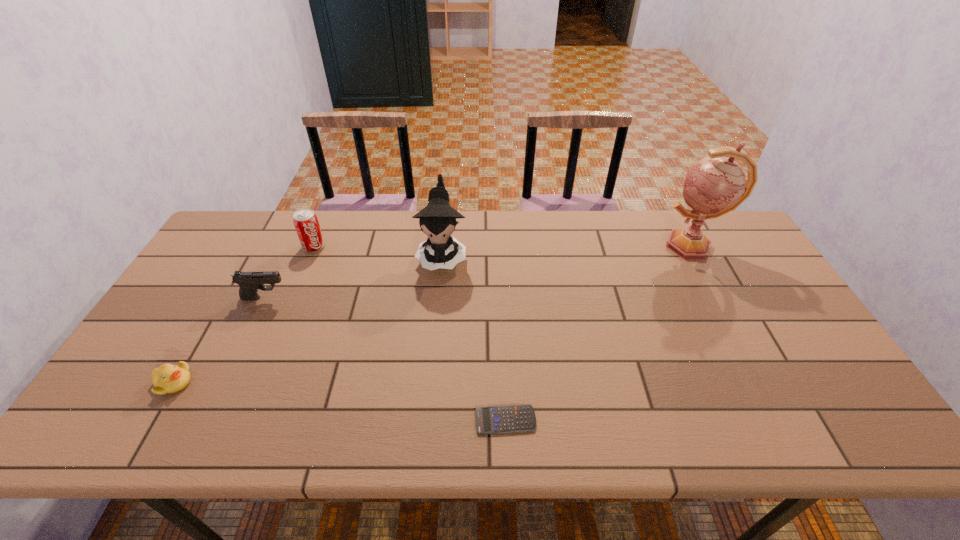
What are the coordinates of `doll that is positioned at the far edge` in the screenshot? It's located at (438, 219).

I want to click on soda can that is at the far edge, so click(306, 223).

Find the location of a particular element. object present at the near edge is located at coordinates (502, 419).

Locate an element on the screen. object at the left edge is located at coordinates (168, 378).

I want to click on object that is positioned at the right edge, so click(x=715, y=185).

Find the location of a particular element. The height and width of the screenshot is (540, 960). object positioned at the far right corner is located at coordinates (715, 185).

This screenshot has height=540, width=960. Identify the location of free space at the far edge. (609, 213).

Where is `free space at the near edge`? The image size is (960, 540). free space at the near edge is located at coordinates (756, 440).

Where is `vacant area at the left edge`? vacant area at the left edge is located at coordinates (191, 280).

The image size is (960, 540). In the image, there is a desktop. What are the coordinates of `vacant space at the right edge` in the screenshot? It's located at click(x=780, y=355).